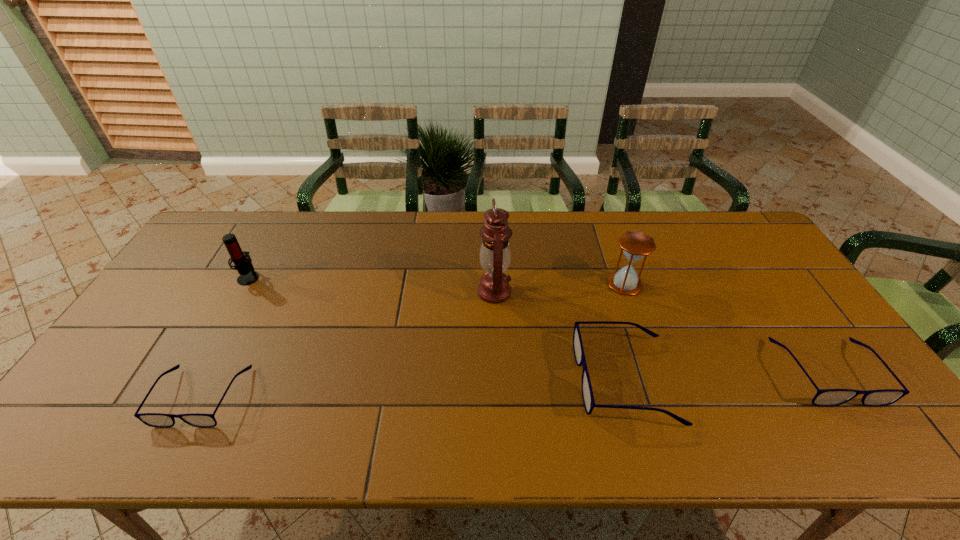
Please mark a free spot for a new spectacles to balance the arrangement. Please provide its 2D coordinates. Your answer should be formatted as a tuple, i.e. [(x, y)], where the tuple contains the x and y coordinates of a point satisfying the conditions above.

[(417, 388)]